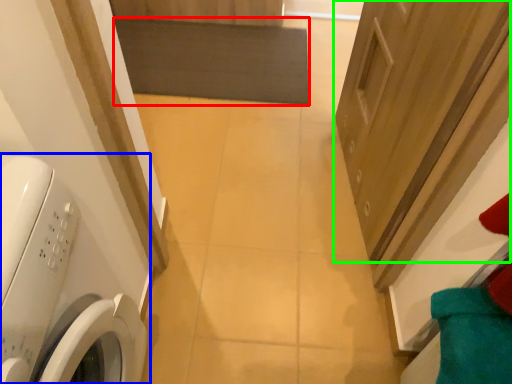
Question: Which is farther away from mat (highlighted by a red box)? washing machine (highlighted by a blue box) or door (highlighted by a green box)?

Choices:
 (A) washing machine
 (B) door

Answer: (A)